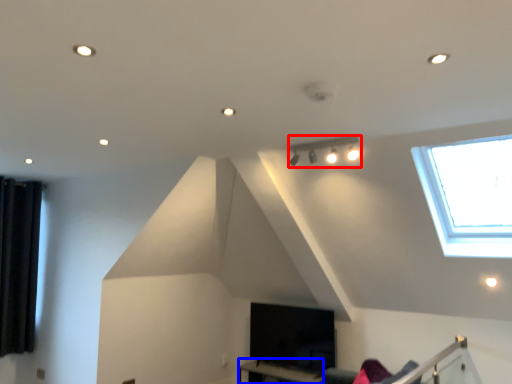
Question: Which object appears farthest to the camera in this image, lamp (highlighted by a red box) or table (highlighted by a blue box)?

Choices:
 (A) lamp
 (B) table

Answer: (B)